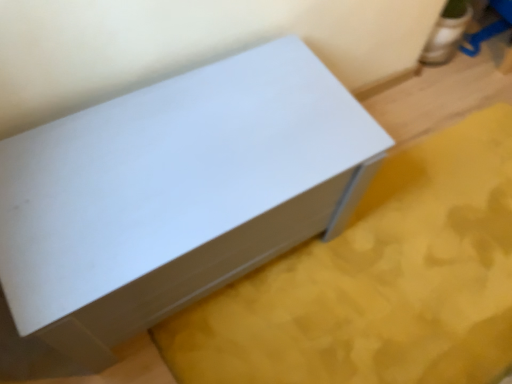
Find the location of a particular element. This screenshot has height=384, width=512. empty space that is ontop of white matte table at center (from a real-world perspective) is located at coordinates coord(160,161).